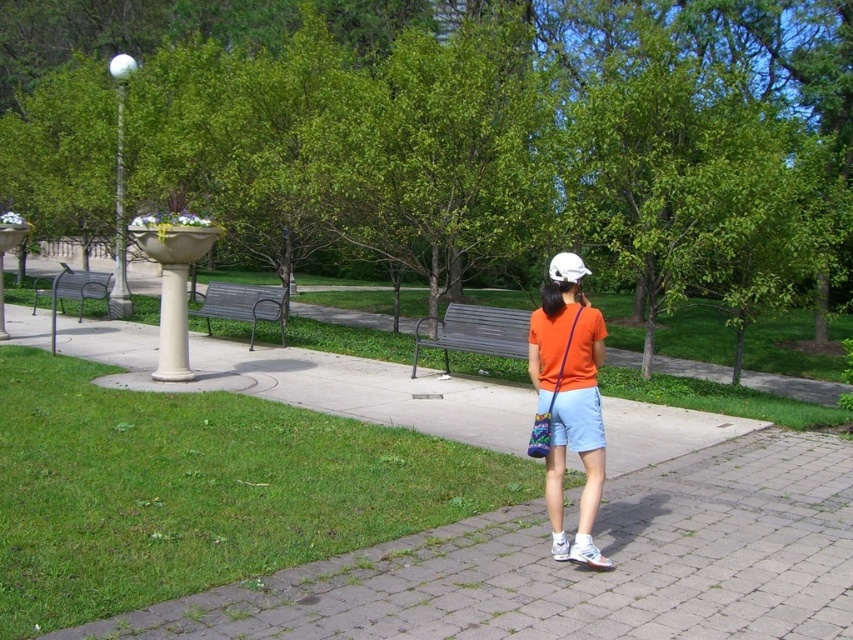
You are standing at the point labeled as point (577, 564) in the park. What is the surface material under your feet?

The surface material under your feet at point (577, 564) is gray brick pavement.

You are a park visitor who wants to sit on the metallic gray bench at center and the metallic gray bench at left. Which bench should you approach first if you are standing at the start of the pathway and want to visit both benches in order from left to right?

You should first approach the metallic gray bench at left because it is positioned to the left of the metallic gray bench at center, so visiting them from left to right would require starting with the metallic gray bench at left.

What is the 2D coordinate of the gray brick pavement at lower center in the image?

The gray brick pavement at lower center is located at the 2D coordinate point of (577, 564).